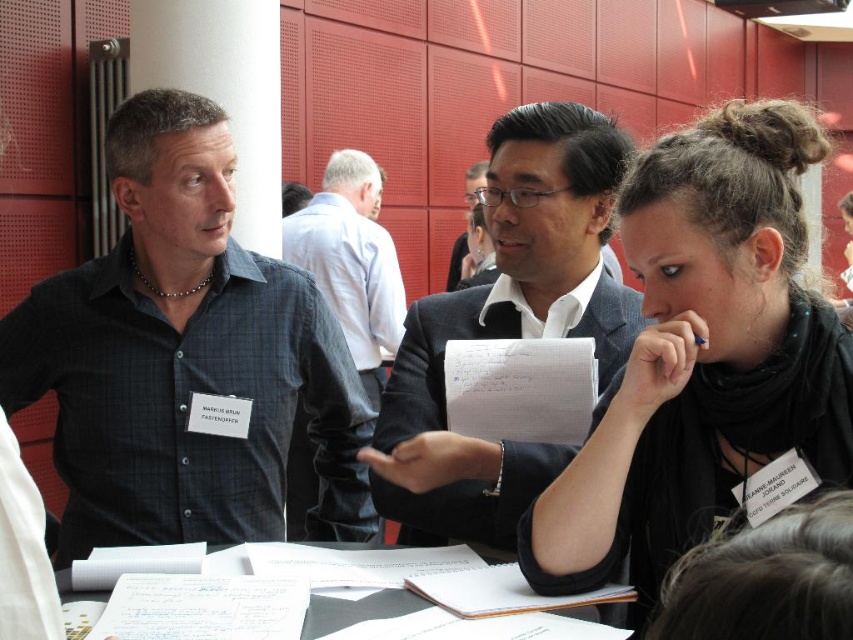
Question: Does black matte hair at center have a smaller size compared to matte black suit at center?

Choices:
 (A) yes
 (B) no

Answer: (A)

Question: Which of these objects is positioned closest to the matte black suit at center?

Choices:
 (A) black matte hair at center
 (B) black checkered shirt at left
 (C) white shirt at center
 (D) dark gray suit at center

Answer: (C)

Question: Can you confirm if dark gray suit at center is positioned above white shirt at center?

Choices:
 (A) no
 (B) yes

Answer: (A)

Question: Can you confirm if black matte hair at center is positioned above matte black suit at center?

Choices:
 (A) yes
 (B) no

Answer: (B)

Question: Which point appears closest to the camera in this image?

Choices:
 (A) (424, 362)
 (B) (219, 208)

Answer: (B)

Question: Which is farther from the dark gray suit at center?

Choices:
 (A) matte black suit at center
 (B) white shirt at center
 (C) black matte hair at center

Answer: (A)